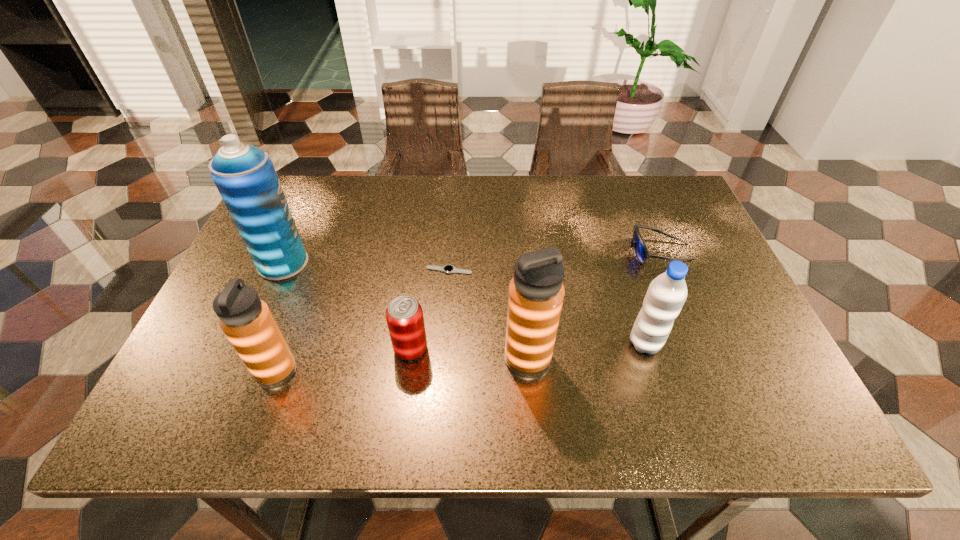
Where is `the left thermos bottle`? This screenshot has width=960, height=540. the left thermos bottle is located at coordinates (247, 322).

This screenshot has height=540, width=960. I want to click on the sixth shortest object, so click(x=536, y=292).

Where is `the right thermos bottle`? The height and width of the screenshot is (540, 960). the right thermos bottle is located at coordinates (536, 292).

Identify the location of the sixth tallest object. This screenshot has height=540, width=960. 641,252.

Where is `aerosol can`? aerosol can is located at coordinates (244, 175).

Find the location of `the shortest object`. the shortest object is located at coordinates (448, 269).

Locate an element on the screen. The image size is (960, 540). the third shortest object is located at coordinates [404, 315].

Locate an element on the screen. water bottle is located at coordinates (666, 295).

What are the coordinates of `vacant space located on the back of the shorter thermos bottle` in the screenshot? It's located at (298, 314).

Where is `free space located on the right of the taller thermos bottle`? The width and height of the screenshot is (960, 540). free space located on the right of the taller thermos bottle is located at coordinates (694, 358).